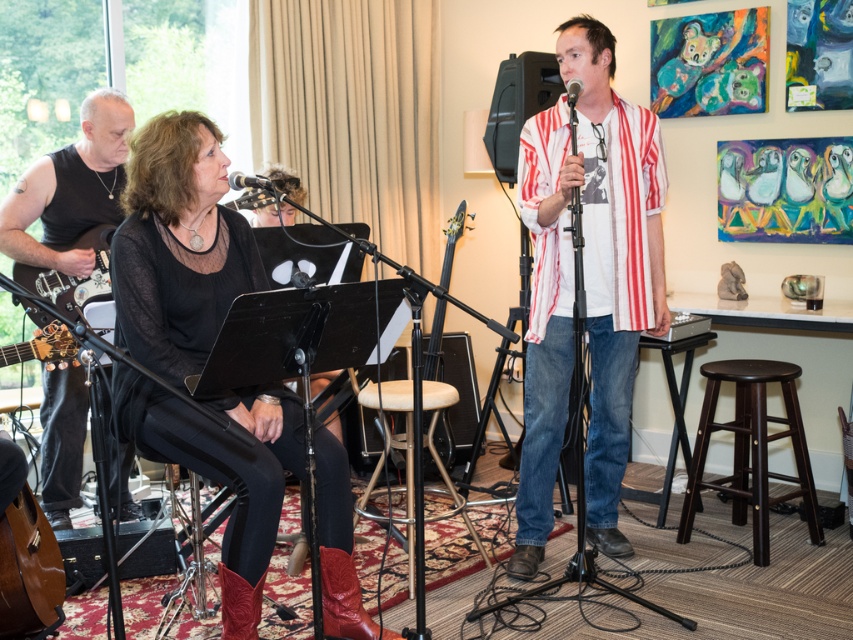
Is point (59, 170) positioned in front of point (245, 580)?

No, (59, 170) is further to viewer.

Which is more to the left, black leather guitar at left or leather cowboy boot at lower left?

black leather guitar at left is more to the left.

Does point (82, 176) come farther from viewer compared to point (219, 564)?

Yes, it is behind point (219, 564).

You are a GUI agent. You are given a task and a screenshot of the screen. Output one action in this format:
    pyautogui.click(x=<x>, y=<y>)
    Task: Click on the black leather guitar at left
    
    Given the screenshot: What is the action you would take?
    pos(70,189)

Is point (221, 483) closer to viewer compared to point (228, 586)?

No, it is behind (228, 586).

Can you confirm if matte black dress at center is wider than leather cowboy boot at lower left?

Indeed, matte black dress at center has a greater width compared to leather cowboy boot at lower left.

Which is in front, point (227, 401) or point (247, 634)?

Positioned in front is point (227, 401).

At what (x,y) coordinates should I click in order to perform the action: click on matte black dress at center. Please return your answer as a coordinate pair (x, y). Looking at the image, I should click on (178, 246).

Who is positioned more to the left, black leather guitar at left or dark wood stool at lower right?

black leather guitar at left

Describe the element at coordinates (70, 189) in the screenshot. I see `black leather guitar at left` at that location.

Find the location of a particular element. The image size is (853, 640). black leather guitar at left is located at coordinates (70, 189).